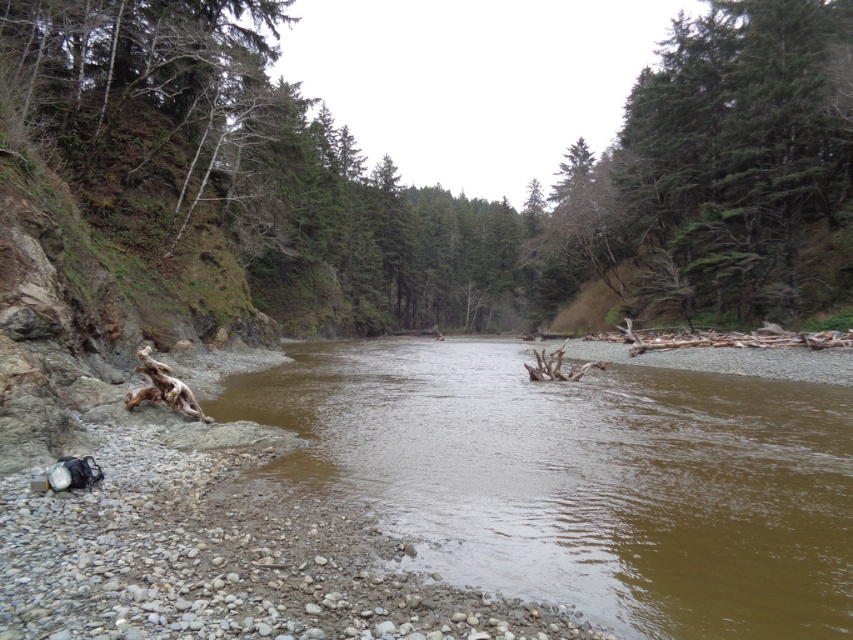
Which of these two, brown muddy water at center or green textured tree at upper right, stands shorter?

brown muddy water at center

Can you confirm if brown muddy water at center is positioned below green textured tree at upper right?

Yes, brown muddy water at center is below green textured tree at upper right.

I want to click on brown muddy water at center, so click(x=583, y=480).

The image size is (853, 640). Identify the location of brown muddy water at center. (583, 480).